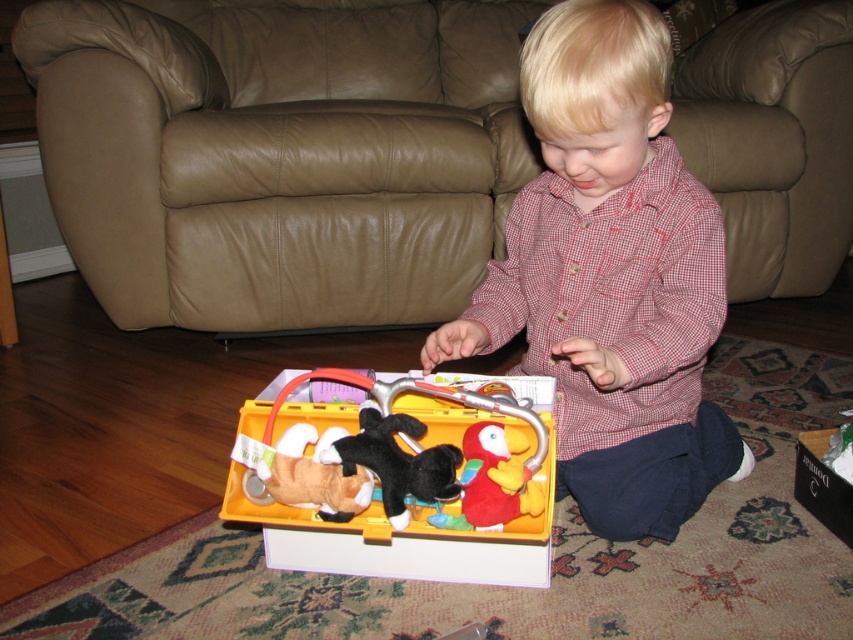
Consider the image. Between yellow plastic toolbox at center and cardboard box at lower right, which one is positioned higher?

Positioned higher is yellow plastic toolbox at center.

Is point (347, 540) more distant than point (811, 472)?

No, (347, 540) is in front of (811, 472).

Locate an element on the screen. yellow plastic toolbox at center is located at coordinates (399, 538).

Can you confirm if brown leather armchair at center is bigger than velvet plush parrot at center?

Indeed, brown leather armchair at center has a larger size compared to velvet plush parrot at center.

Locate an element on the screen. Image resolution: width=853 pixels, height=640 pixels. brown leather armchair at center is located at coordinates (279, 154).

At what (x,y) coordinates should I click in order to perform the action: click on brown leather armchair at center. Please return your answer as a coordinate pair (x, y). Looking at the image, I should click on (279, 154).

Who is shorter, brown leather armchair at center or yellow plastic toolbox at center?

yellow plastic toolbox at center is shorter.

Between brown leather armchair at center and yellow plastic toolbox at center, which one appears on the right side from the viewer's perspective?

yellow plastic toolbox at center

What do you see at coordinates (279, 154) in the screenshot? I see `brown leather armchair at center` at bounding box center [279, 154].

Where is `brown leather armchair at center`? brown leather armchair at center is located at coordinates (279, 154).